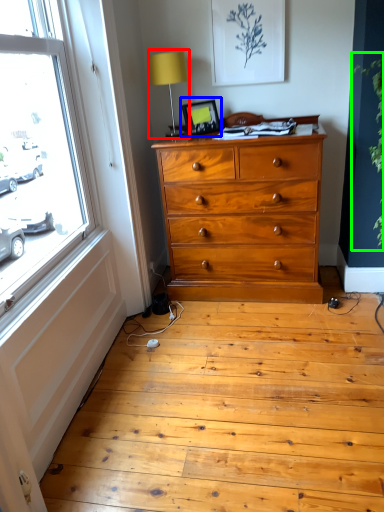
Question: Which is nearer to the table lamp (highlighted by a red box)? picture frame (highlighted by a blue box) or plant (highlighted by a green box).

Choices:
 (A) picture frame
 (B) plant

Answer: (A)